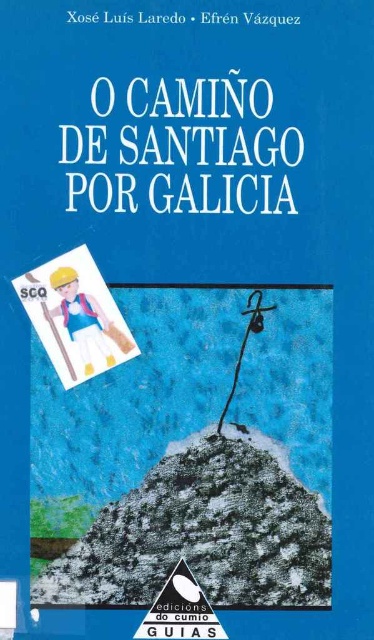
You are designing a book cover and want to ensure the plastic toy figure at upper left is visible. Is the white paper sign at upper left blocking it?

The white paper sign at upper left is positioned over plastic toy figure at upper left, so the sign is blocking the figure and making it less visible.

You are designing a display for a bookstore and want to place both the matte plastic figure at center and the plastic toy figure at upper left on a shelf. Considering their sizes, which figure should be placed at the front so that both are visible?

The plastic toy figure at upper left should be placed at the front since it is shorter than the matte plastic figure at center, allowing both to be visible without blocking each other.